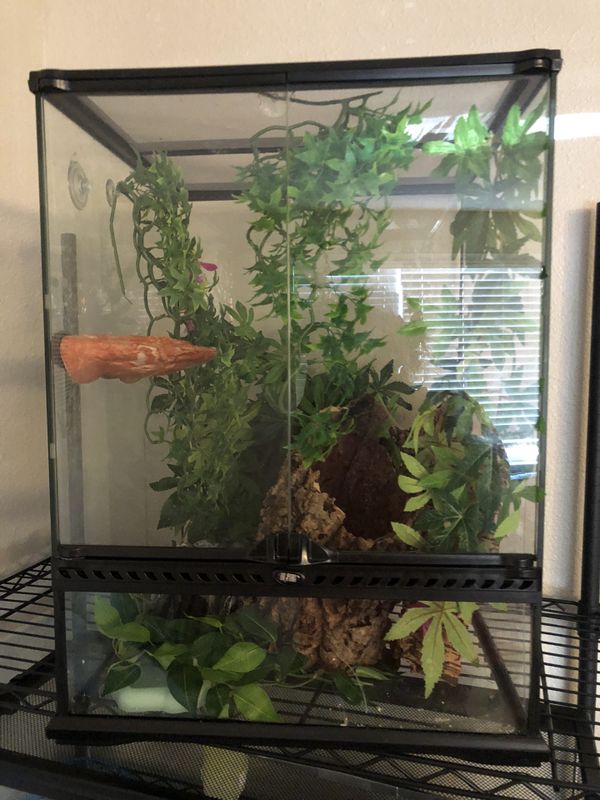
Where is `see through glass container`? The image size is (600, 800). see through glass container is located at coordinates (266, 638), (234, 444), (243, 148), (75, 213), (486, 338), (456, 674).